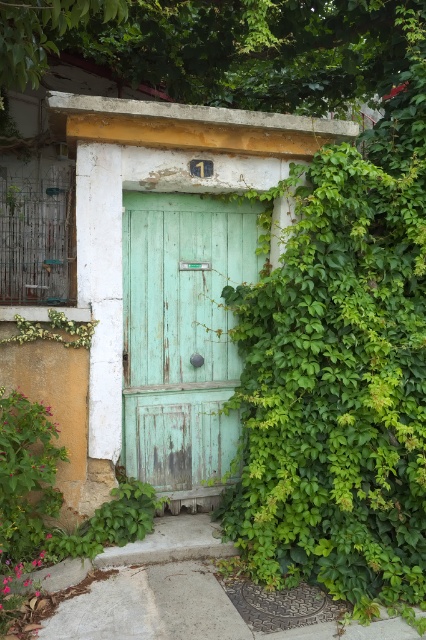
Can you confirm if green wooden door at center is positioned to the left of green matte door at center?

Indeed, green wooden door at center is positioned on the left side of green matte door at center.

The width and height of the screenshot is (426, 640). I want to click on green wooden door at center, so click(140, 280).

Find the location of a particular element. green wooden door at center is located at coordinates tap(140, 280).